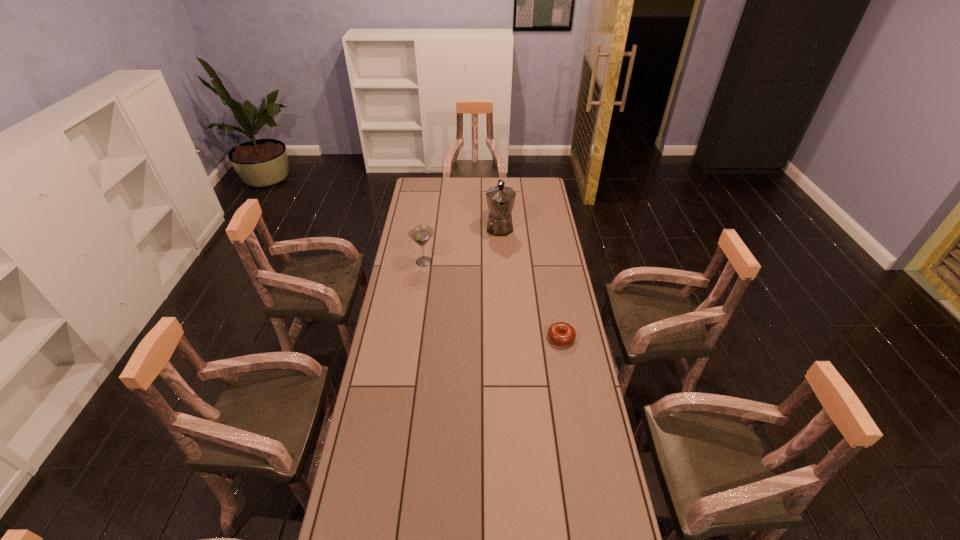
At what (x,y) coordinates should I click in order to perform the action: click on the farthest object. Please return your answer as a coordinate pair (x, y). This screenshot has width=960, height=540. Looking at the image, I should click on (500, 199).

Locate an element on the screen. the second object from left to right is located at coordinates (500, 199).

I want to click on the leftmost object, so click(x=421, y=234).

At what (x,y) coordinates should I click in order to perform the action: click on the second farthest object. Please return your answer as a coordinate pair (x, y). Looking at the image, I should click on (421, 234).

At what (x,y) coordinates should I click in order to perform the action: click on the nearest object. Please return your answer as a coordinate pair (x, y). The image size is (960, 540). Looking at the image, I should click on (560, 333).

What are the coordinates of `doughnut` in the screenshot? It's located at (560, 333).

You are a GUI agent. You are given a task and a screenshot of the screen. Output one action in this format:
    pyautogui.click(x=<x>, y=<y>)
    Task: Click on the vacant space located on the pouring side of the coffeepot
    This screenshot has width=960, height=540.
    Given the screenshot: What is the action you would take?
    pyautogui.click(x=502, y=270)

The width and height of the screenshot is (960, 540). Find the location of `vacant point located 0.070m on the right of the martini`. vacant point located 0.070m on the right of the martini is located at coordinates (451, 261).

Locate an element on the screen. The image size is (960, 540). free spot located 0.180m on the left of the nearest object is located at coordinates (503, 338).

The height and width of the screenshot is (540, 960). Find the location of `object that is at the left edge`. object that is at the left edge is located at coordinates (421, 234).